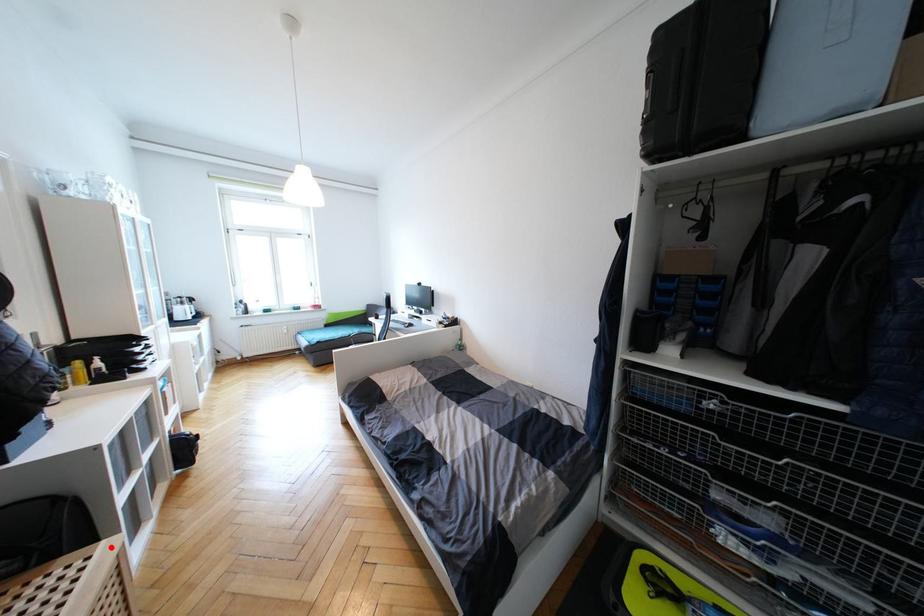
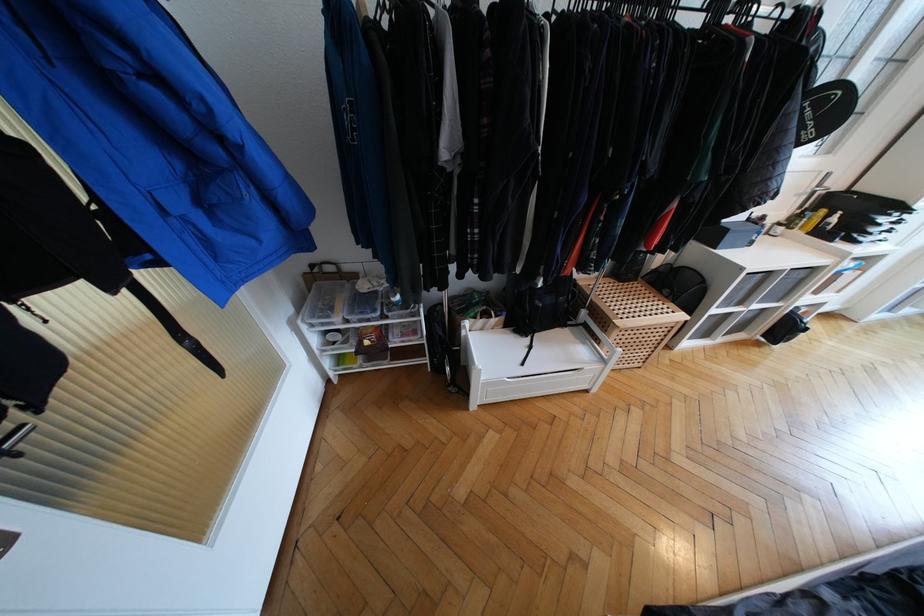
Locate, in the second image, the point that corresponds to the highlighted location in the first image.

(685, 317)